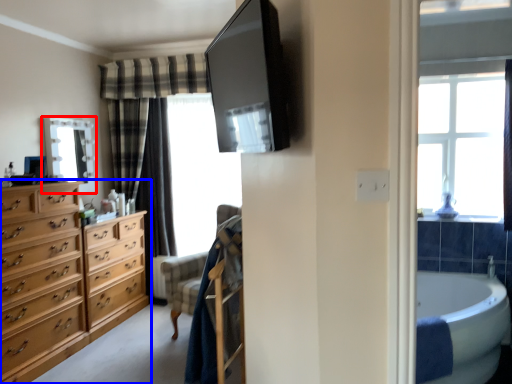
Question: Which of the following is the farthest to the observer, mirror (highlighted by a red box) or chest of drawers (highlighted by a blue box)?

Choices:
 (A) mirror
 (B) chest of drawers

Answer: (A)